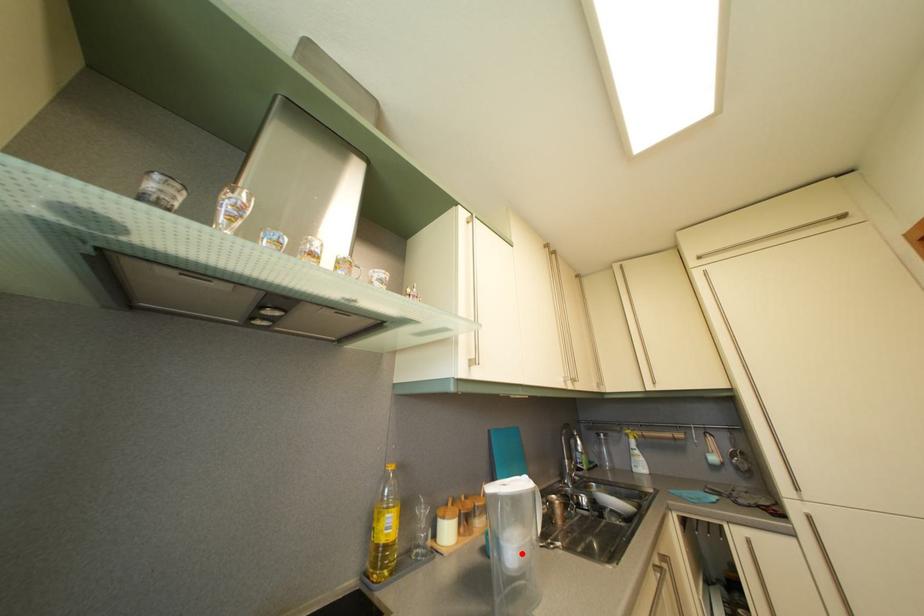
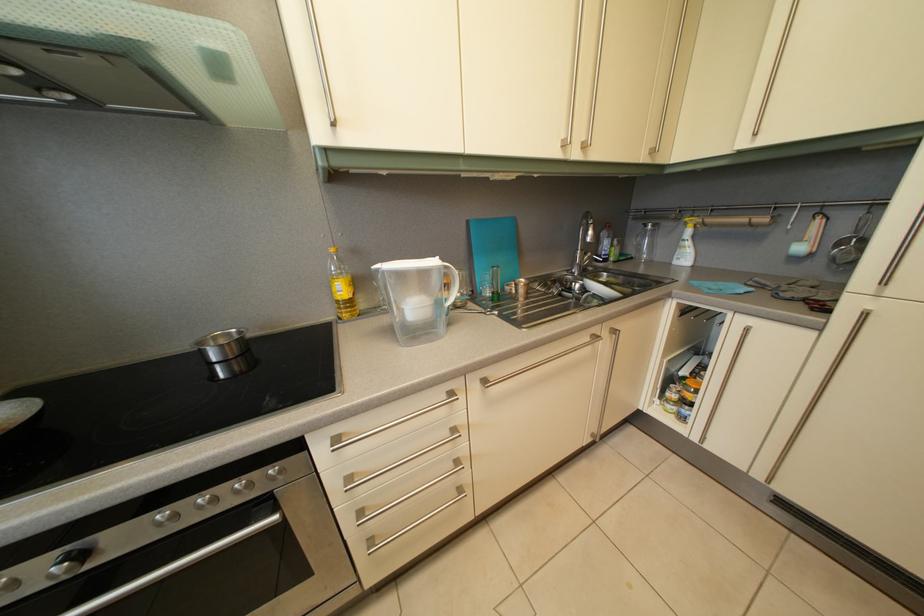
Find the pixel in the second image that matches the highlighted location in the first image.

(421, 315)